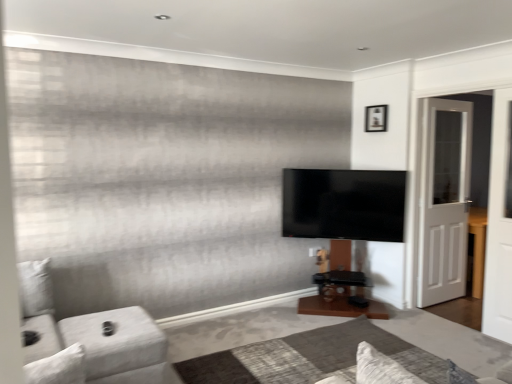
Based on the photo, what is the approximate height of wooden picture frame at upper right?

11.02 inches.

Identify the location of white wooden door at right. This screenshot has height=384, width=512. (444, 200).

Image resolution: width=512 pixels, height=384 pixels. In order to click on wooden picture frame at upper right in this screenshot , I will do `click(376, 118)`.

Does wooden picture frame at upper right appear on the left side of white wooden screen door at right?

Yes, wooden picture frame at upper right is to the left of white wooden screen door at right.

Does wooden picture frame at upper right have a greater width compared to white wooden screen door at right?

No.

In the scene shown: Is wooden picture frame at upper right facing away from white wooden screen door at right?

wooden picture frame at upper right is not turned away from white wooden screen door at right.

From a real-world perspective, between wooden picture frame at upper right and white wooden screen door at right, who is vertically lower?

From a 3D spatial view, white wooden screen door at right is below.

From a real-world perspective, is wooden picture frame at upper right beneath white wooden door at right?

No, from a real-world perspective, wooden picture frame at upper right is not below white wooden door at right.

Considering the sizes of objects wooden picture frame at upper right and white wooden door at right in the image provided, who is thinner, wooden picture frame at upper right or white wooden door at right?

wooden picture frame at upper right.

Which object is positioned more to the left, wooden picture frame at upper right or white wooden door at right?

Positioned to the left is wooden picture frame at upper right.

How many degrees apart are the facing directions of wooden picture frame at upper right and white wooden door at right?

The facing directions of wooden picture frame at upper right and white wooden door at right are 91.5 degrees apart.

From the image's perspective, is white wooden door at right on top of white fabric couch at lower left?

Correct, white wooden door at right appears higher than white fabric couch at lower left in the image.

Is white wooden door at right wider or thinner than white fabric couch at lower left?

In the image, white wooden door at right appears to be more narrow than white fabric couch at lower left.

Are white wooden door at right and white fabric couch at lower left located far from each other?

white wooden door at right is positioned a significant distance from white fabric couch at lower left.

Is point (436, 170) closer to camera compared to point (125, 309)?

That is False.

What's the angular difference between white wooden screen door at right and white wooden door at right's facing directions?

The facing directions of white wooden screen door at right and white wooden door at right are 91.5 degrees apart.

Considering the sizes of objects white wooden screen door at right and white wooden door at right in the image provided, who is taller, white wooden screen door at right or white wooden door at right?

With more height is white wooden door at right.

From a real-world perspective, is white wooden screen door at right on top of white wooden door at right?

Yes, from a real-world perspective, white wooden screen door at right is above white wooden door at right.

Locate an element on the screen. This screenshot has width=512, height=384. door located on the right of matte black tv at center is located at coordinates (444, 200).

Is matte black tv at center inside or outside of white wooden door at right?

matte black tv at center is located beyond the bounds of white wooden door at right.

What's the angular difference between matte black tv at center and white wooden door at right's facing directions?

36.2 degrees.

From a real-world perspective, between matte black tv at center and white wooden door at right, who is vertically lower?

From a 3D spatial view, matte black tv at center is below.

Is white wooden door at right taller than matte black tv at center?

Yes, white wooden door at right is taller than matte black tv at center.

Could you tell me if white wooden door at right is facing matte black tv at center?

No, white wooden door at right is not facing towards matte black tv at center.

From the image's perspective, which is above, white wooden door at right or matte black tv at center?

white wooden door at right appears higher in the image.

In the scene shown: How many degrees apart are the facing directions of white wooden door at right and matte black tv at center?

36.2 degrees separate the facing orientations of white wooden door at right and matte black tv at center.

Is wooden picture frame at upper right positioned behind matte black tv at center?

Yes, wooden picture frame at upper right is behind matte black tv at center.

Can you confirm if wooden picture frame at upper right is positioned to the right of matte black tv at center?

Indeed, wooden picture frame at upper right is positioned on the right side of matte black tv at center.

You are a GUI agent. You are given a task and a screenshot of the screen. Output one action in this format:
    pyautogui.click(x=<x>, y=<y>)
    Task: Click on the picture frame located above the matte black tv at center (from a real-world perspective)
    
    Given the screenshot: What is the action you would take?
    pyautogui.click(x=376, y=118)

Locate an element on the screen. picture frame to the left of white wooden screen door at right is located at coordinates (376, 118).

Locate an element on the screen. Image resolution: width=512 pixels, height=384 pixels. door that is under the wooden picture frame at upper right (from a real-world perspective) is located at coordinates (444, 200).

Looking at the image, which one is located closer to white wooden screen door at right, wooden picture frame at upper right or white fabric couch at lower left?

wooden picture frame at upper right is closer to white wooden screen door at right.

Considering their positions, is white fabric couch at lower left positioned further to matte black tv at center than white wooden screen door at right?

The object further to matte black tv at center is white fabric couch at lower left.

From the image, which object appears to be nearer to white wooden door at right, white fabric couch at lower left or matte black tv at center?

The object closer to white wooden door at right is matte black tv at center.

Which object lies further to the anchor point white wooden door at right, wooden picture frame at upper right or white wooden screen door at right?

wooden picture frame at upper right is further to white wooden door at right.

From the image, which object appears to be nearer to white fabric couch at lower left, white wooden door at right or matte black tv at center?

matte black tv at center.

When comparing their distances from white wooden screen door at right, does white wooden door at right or matte black tv at center seem further?

The object further to white wooden screen door at right is matte black tv at center.

Which object lies nearer to the anchor point white wooden screen door at right, white fabric couch at lower left or matte black tv at center?

The object closer to white wooden screen door at right is matte black tv at center.

Based on their spatial positions, is wooden picture frame at upper right or matte black tv at center further from white fabric couch at lower left?

wooden picture frame at upper right.

Locate an element on the screen. This screenshot has width=512, height=384. door between white fabric couch at lower left and white wooden screen door at right is located at coordinates (444, 200).

This screenshot has height=384, width=512. I want to click on television located between white fabric couch at lower left and white wooden screen door at right in the left-right direction, so click(x=344, y=204).

Identify the location of door between white fabric couch at lower left and wooden picture frame at upper right from front to back. This screenshot has height=384, width=512. (444, 200).

Image resolution: width=512 pixels, height=384 pixels. I want to click on door between white wooden screen door at right and wooden picture frame at upper right from front to back, so click(x=444, y=200).